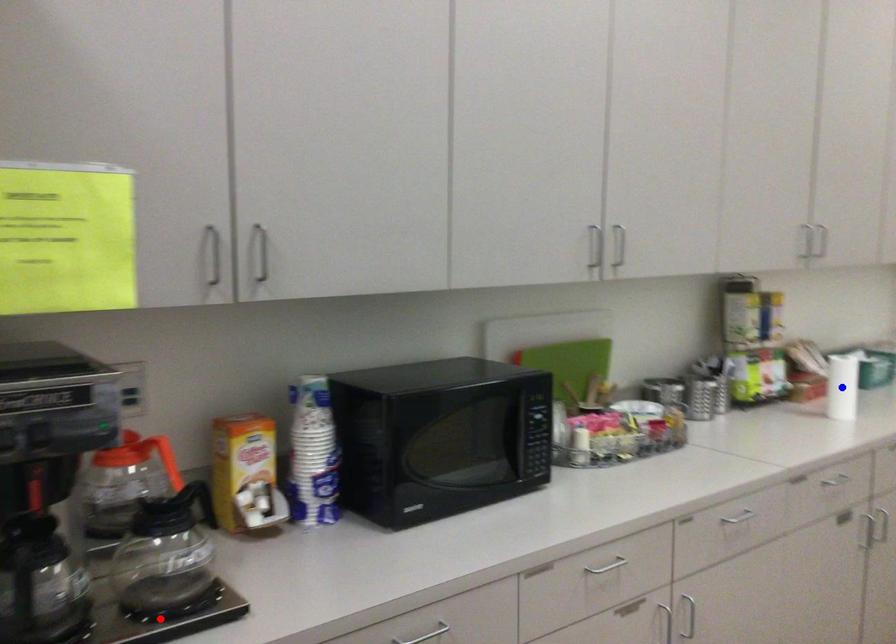
Question: Two points are marked on the image. Which point is closer to the camera?

Choices:
 (A) Blue point is closer.
 (B) Red point is closer.

Answer: (B)